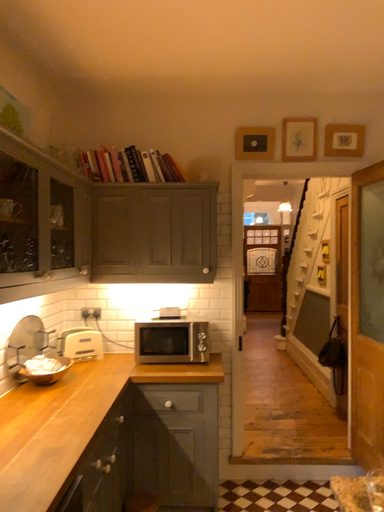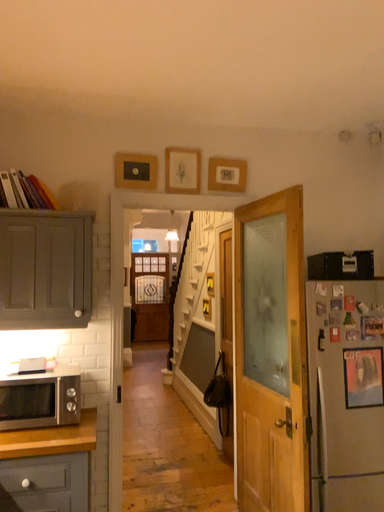
Question: Which way did the camera rotate in the video?

Choices:
 (A) rotated left
 (B) rotated right

Answer: (B)